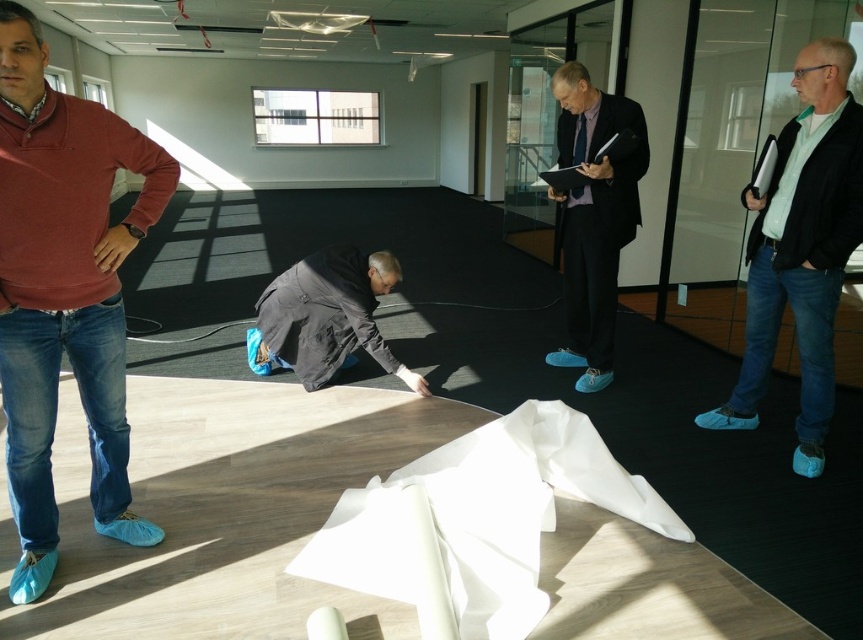
Question: Based on their relative distances, which object is nearer to the dark blue suit at center?

Choices:
 (A) blue suede shoes at right
 (B) black matte jacket at center

Answer: (A)

Question: Can you confirm if blue suede shoes at right is smaller than dark blue suit at center?

Choices:
 (A) no
 (B) yes

Answer: (B)

Question: Can you confirm if matte red sweater at left is positioned below black matte jacket at center?

Choices:
 (A) yes
 (B) no

Answer: (B)

Question: Which object appears farthest from the camera in this image?

Choices:
 (A) matte red sweater at left
 (B) blue suede shoes at right
 (C) black matte jacket at center

Answer: (C)

Question: Which point is farther to the camera?

Choices:
 (A) black matte jacket at center
 (B) dark blue suit at center
 (C) matte red sweater at left
 (D) blue suede shoes at right

Answer: (A)

Question: Considering the relative positions of matte red sweater at left and blue suede shoes at right in the image provided, where is matte red sweater at left located with respect to blue suede shoes at right?

Choices:
 (A) above
 (B) below

Answer: (B)